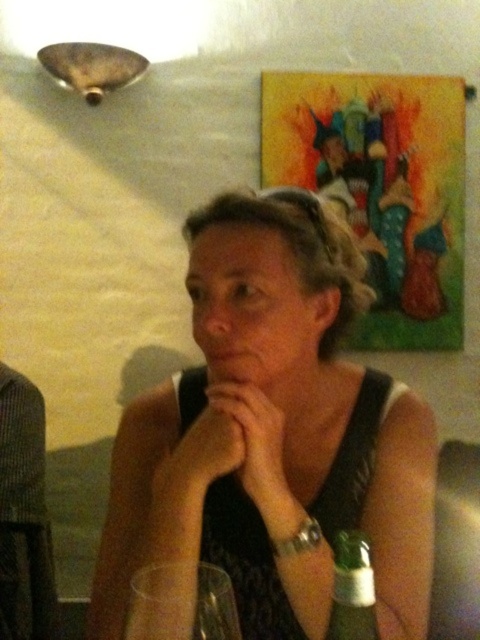
Which is more to the left, matte black tank top at center or green glass bottle at lower right?

matte black tank top at center is more to the left.

Is matte black tank top at center closer to the viewer compared to green glass bottle at lower right?

No, it is behind green glass bottle at lower right.

At what (x,y) coordinates should I click in order to perform the action: click on matte black tank top at center. Please return your answer as a coordinate pair (x, y). Looking at the image, I should click on (273, 435).

At what (x,y) coordinates should I click in order to perform the action: click on matte black tank top at center. Please return your answer as a coordinate pair (x, y). Looking at the image, I should click on (273, 435).

Between matte black tank top at center and transparent plastic wine glass at lower center, which one is positioned lower?

transparent plastic wine glass at lower center is lower down.

Does matte black tank top at center have a smaller size compared to transparent plastic wine glass at lower center?

No, matte black tank top at center is not smaller than transparent plastic wine glass at lower center.

The width and height of the screenshot is (480, 640). Identify the location of matte black tank top at center. (x=273, y=435).

Can you confirm if transparent plastic wine glass at lower center is taller than green glass bottle at lower right?

No.

Is point (188, 563) positioned in front of point (356, 548)?

No, it is behind (356, 548).

Where is `transparent plastic wine glass at lower center`? transparent plastic wine glass at lower center is located at coordinates (181, 602).